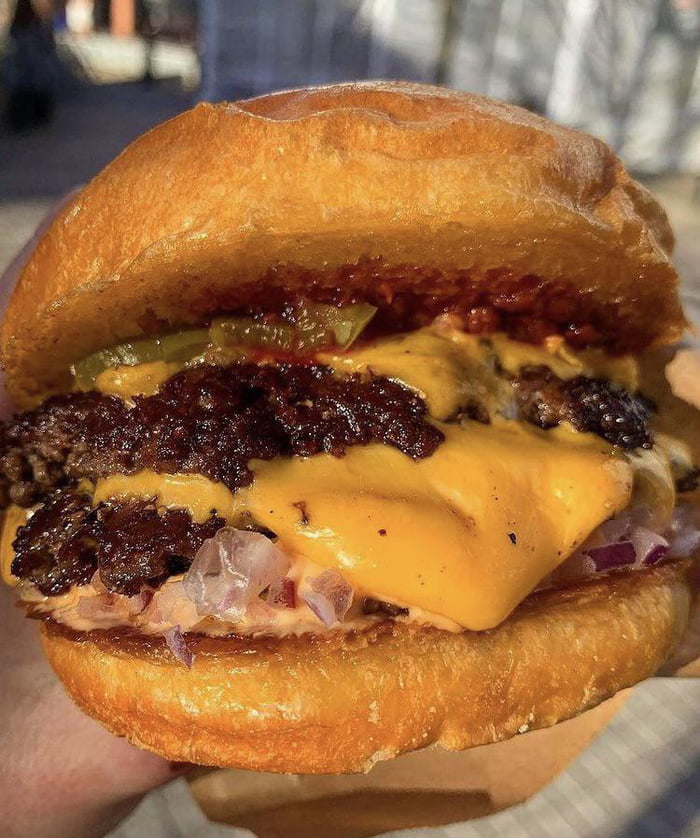
The image size is (700, 838). What are the coordinates of `wall` in the screenshot? It's located at (425, 49).